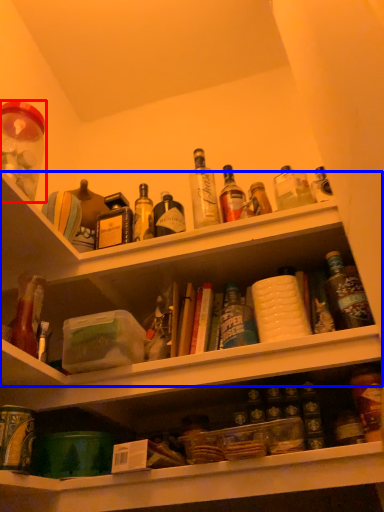
Question: Which object appears closest to the camera in this image, beverage (highlighted by a red box) or shelf (highlighted by a blue box)?

Choices:
 (A) beverage
 (B) shelf

Answer: (A)